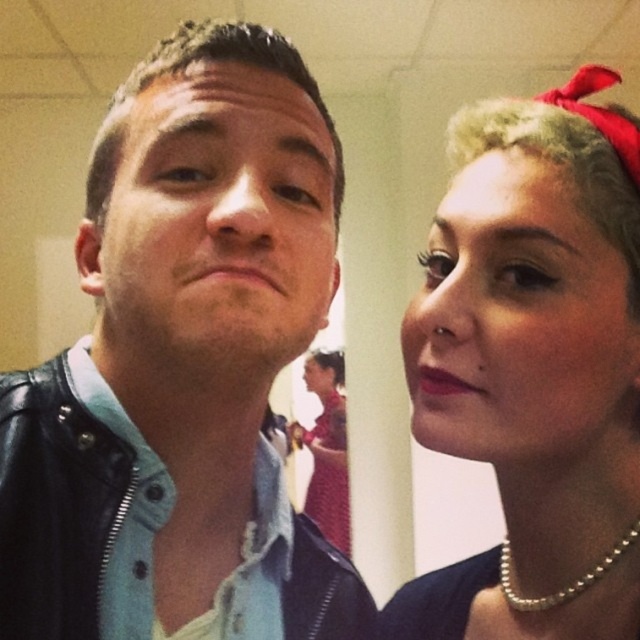
Does shiny red dress at center come in front of pearl necklace at lower right?

That is False.

Can you confirm if shiny red dress at center is positioned to the left of pearl necklace at lower right?

Yes, shiny red dress at center is to the left of pearl necklace at lower right.

Is point (305, 444) closer to viewer compared to point (586, 576)?

No, it is behind (586, 576).

Where is `shiny red dress at center`? The width and height of the screenshot is (640, 640). shiny red dress at center is located at coordinates (326, 449).

Is matte red headband at upper right thinner than pearl necklace at lower right?

No, matte red headband at upper right is not thinner than pearl necklace at lower right.

Which is behind, point (442, 394) or point (534, 604)?

The point (534, 604) is more distant.

You are a GUI agent. You are given a task and a screenshot of the screen. Output one action in this format:
    pyautogui.click(x=<x>, y=<y>)
    Task: Click on the matte red headband at upper right
    This screenshot has height=640, width=640.
    Given the screenshot: What is the action you would take?
    pyautogui.click(x=522, y=323)

Can you confirm if matte red headband at upper right is positioned to the right of matte black jacket at upper left?

Indeed, matte red headband at upper right is positioned on the right side of matte black jacket at upper left.

Which is behind, point (598, 269) or point (324, 381)?

Positioned behind is point (324, 381).

Where is `matte red headband at upper right`? The image size is (640, 640). matte red headband at upper right is located at coordinates (522, 323).